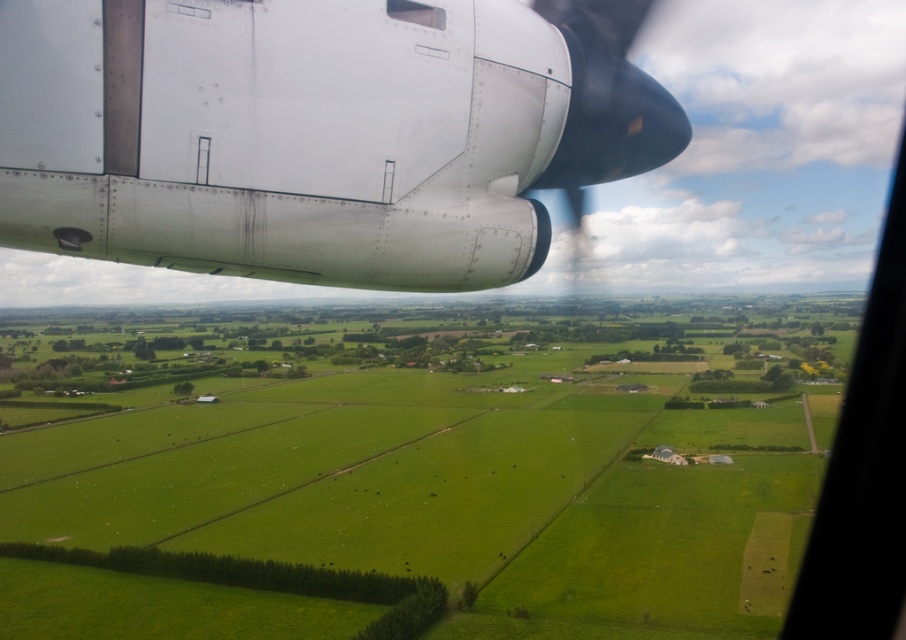
Question: Estimate the real-world distances between objects in this image. Which object is farther from the polished metallic propeller at upper right?

Choices:
 (A) green grassland at center
 (B) transparent plastic airplane window at upper center

Answer: (A)

Question: Is green grassland at center further to the viewer compared to transparent plastic airplane window at upper center?

Choices:
 (A) yes
 (B) no

Answer: (A)

Question: Among these objects, which one is farthest from the camera?

Choices:
 (A) polished metallic propeller at upper right
 (B) transparent plastic airplane window at upper center
 (C) green grassland at center
 (D) metallic silver airplane engine at upper left

Answer: (C)

Question: From the image, what is the correct spatial relationship of polished metallic propeller at upper right in relation to transparent plastic airplane window at upper center?

Choices:
 (A) below
 (B) above

Answer: (B)

Question: Which point is farther from the camera taking this photo?

Choices:
 (A) (610, 109)
 (B) (413, 4)
 (C) (557, 131)

Answer: (A)

Question: Is metallic silver airplane engine at upper left thinner than polished metallic propeller at upper right?

Choices:
 (A) no
 (B) yes

Answer: (B)